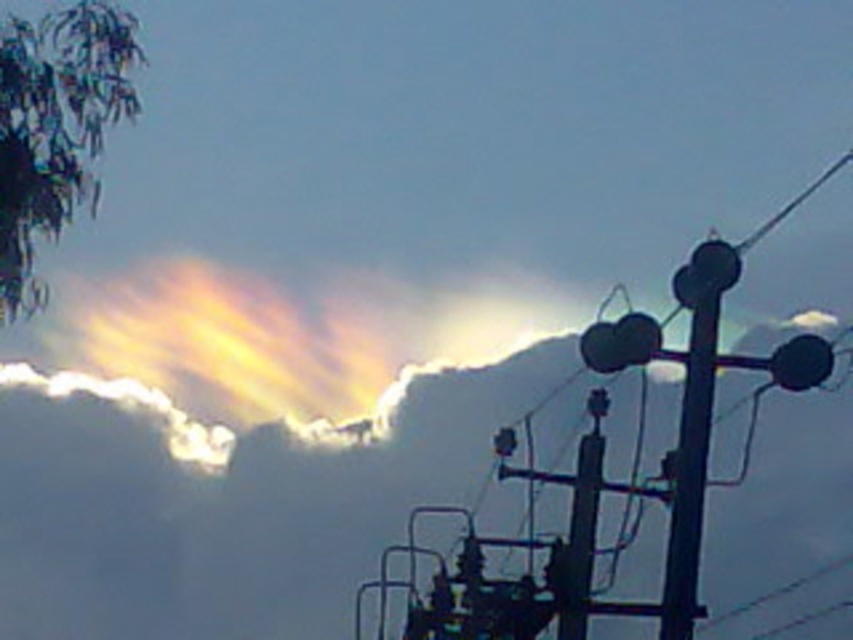
You are a bird flying in the sky and want to land on the closest object between the black metallic pole at center and the metallic wire at right. Which object should you choose?

The black metallic pole at center is to the left of the metallic wire at right, so the metallic wire at right is closer to your current position as you fly in the sky. You should land on the metallic wire at right.

You are a bird flying over the scene. You see the black metallic pole at center and the metallic wire at right. Which object is positioned higher in the sky?

The black metallic pole at center is positioned higher in the sky than the metallic wire at right.

You are an electrician assessing the scene. You need to determine if the metallic wire at right can be safely attached to the top of the black metallic pole at center. Based on their sizes, is this feasible?

The black metallic pole at center is much taller than the metallic wire at right, so the wire is likely too short to reach the top of the pole. This would make it unsafe to attach the wire to the top of the pole.